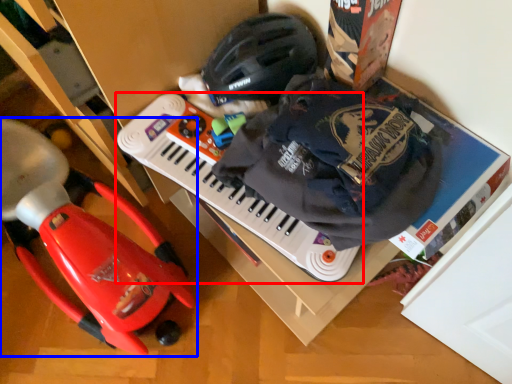
Question: Which of the following is the closest to the observer, musical keyboard (highlighted by a red box) or toy (highlighted by a blue box)?

Choices:
 (A) musical keyboard
 (B) toy

Answer: (B)